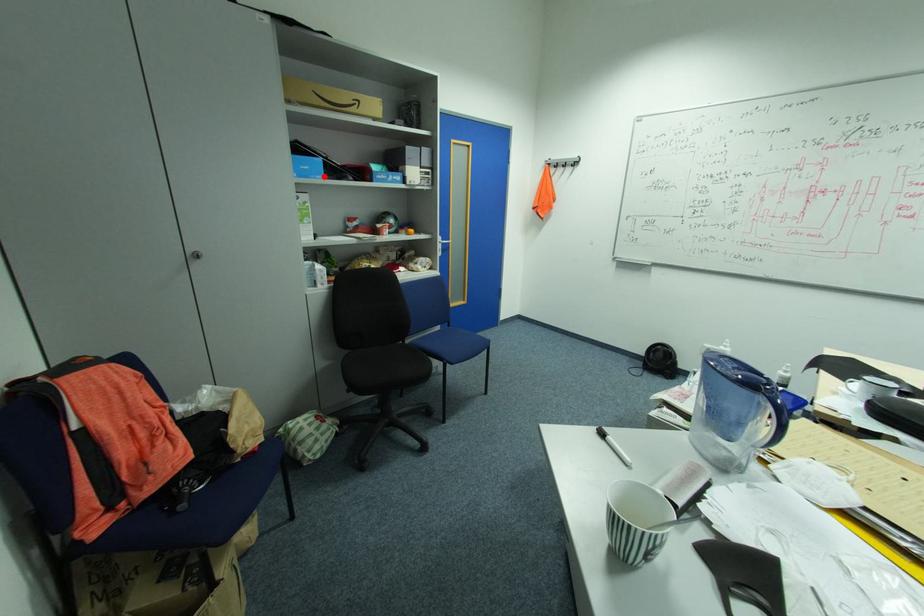
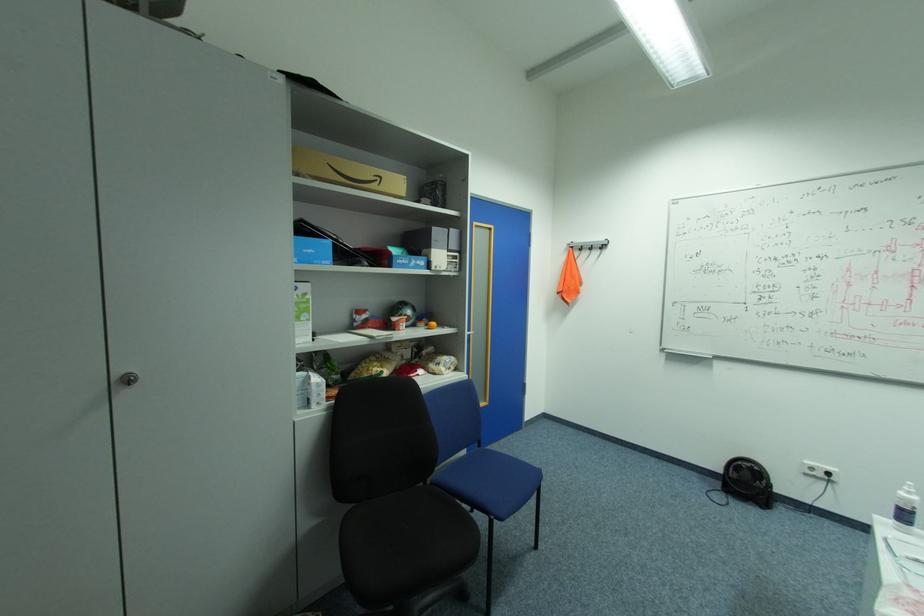
The point at the highlighted location is marked in the first image. Where is the corresponding point in the second image?

(331, 262)